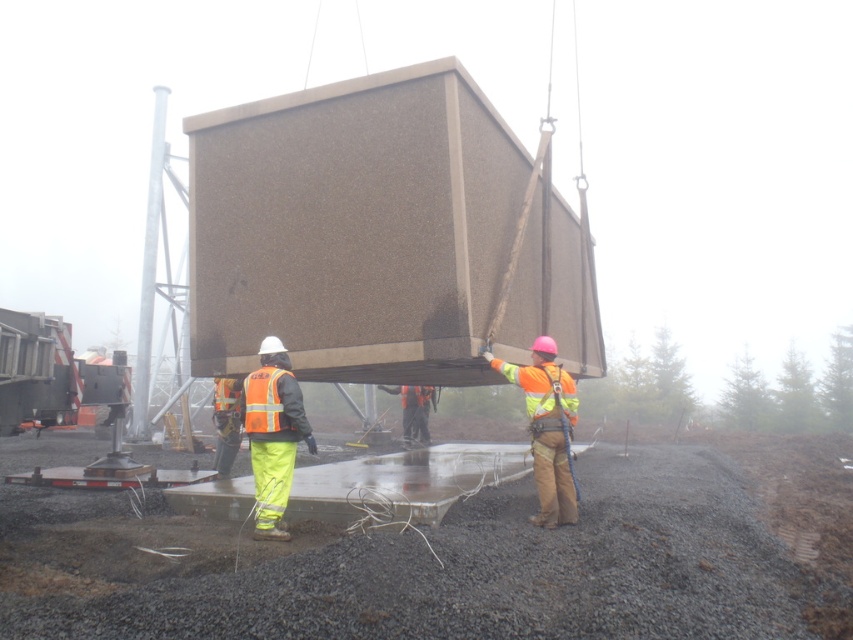
What object is located at the coordinates point (273, 435)?

The point (273, 435) corresponds to the hi visibility reflective jacket at center.